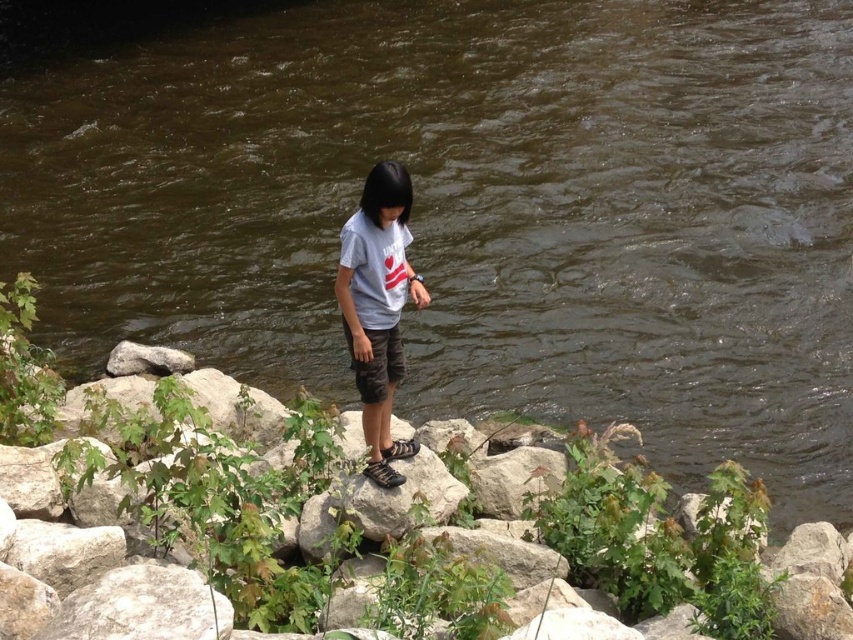
Who is taller, white cotton shirt at center or brown cotton shorts at center?

With more height is white cotton shirt at center.

Does white cotton shirt at center have a lesser width compared to brown cotton shorts at center?

No.

Between point (409, 237) and point (367, 364), which one is positioned in front?

Point (367, 364) is in front.

Where is `white cotton shirt at center`? white cotton shirt at center is located at coordinates (378, 307).

Between brown cotton shorts at center and gray rough rock at lower left, which one is positioned higher?

brown cotton shorts at center is above.

This screenshot has height=640, width=853. In order to click on brown cotton shorts at center in this screenshot , I will do `click(376, 362)`.

Between point (360, 385) and point (120, 372), which one is positioned in front?

Point (360, 385) is more forward.

Image resolution: width=853 pixels, height=640 pixels. I want to click on brown cotton shorts at center, so click(x=376, y=362).

Does brown stone at center have a larger size compared to gray rough rock at lower left?

Correct, brown stone at center is larger in size than gray rough rock at lower left.

Which is more to the right, brown stone at center or gray rough rock at lower left?

Positioned to the right is brown stone at center.

Between point (834, 531) and point (140, 353), which one is positioned in front?

Point (834, 531) is in front.

Find the location of `brown stone at center`. brown stone at center is located at coordinates (221, 506).